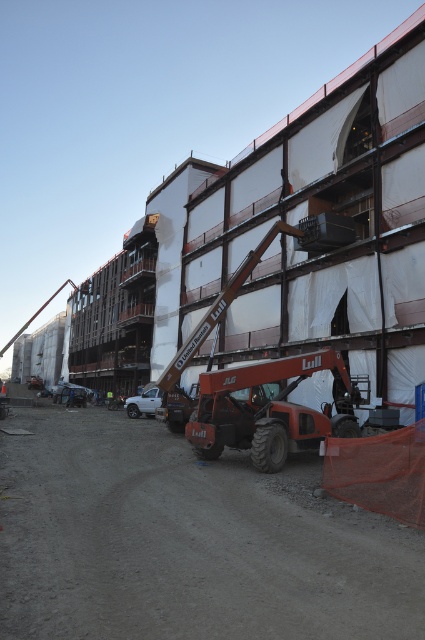
Question: In this image, where is dirt track at center located relative to orange metallic trailer truck at center?

Choices:
 (A) above
 (B) below

Answer: (B)

Question: Which point appears closest to the camera in this image?

Choices:
 (A) (297, 381)
 (B) (34, 586)

Answer: (B)

Question: Which object is closer to the camera taking this photo?

Choices:
 (A) dirt track at center
 (B) orange metallic trailer truck at center

Answer: (A)

Question: Can you confirm if dirt track at center is wider than orange metallic trailer truck at center?

Choices:
 (A) no
 (B) yes

Answer: (B)

Question: Does dirt track at center have a smaller size compared to orange metallic trailer truck at center?

Choices:
 (A) no
 (B) yes

Answer: (A)